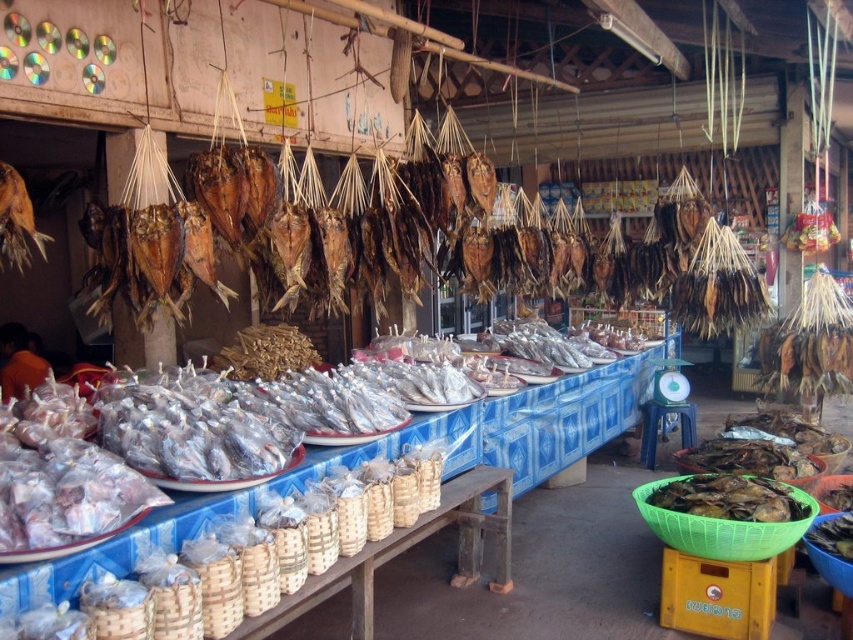
You are a customer at the market stall and want to pick up the brown dried fish at center and the blue woven baskets at center. Which one do you need to reach for first?

The brown dried fish at center is closer to the viewer than the blue woven baskets at center, so you should reach for the brown dried fish at center first.